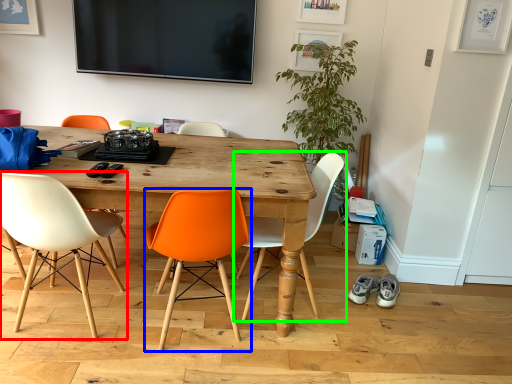
Question: Estimate the real-world distances between objects in this image. Which object is farther from chair (highlighted by a red box), chair (highlighted by a blue box) or chair (highlighted by a green box)?

Choices:
 (A) chair
 (B) chair

Answer: (B)